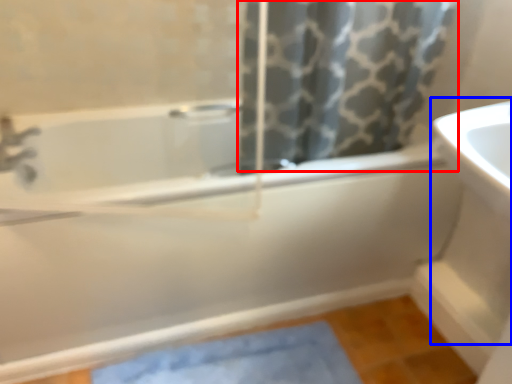
Question: Which object appears closest to the camera in this image, shower curtain (highlighted by a red box) or sink (highlighted by a blue box)?

Choices:
 (A) shower curtain
 (B) sink

Answer: (B)